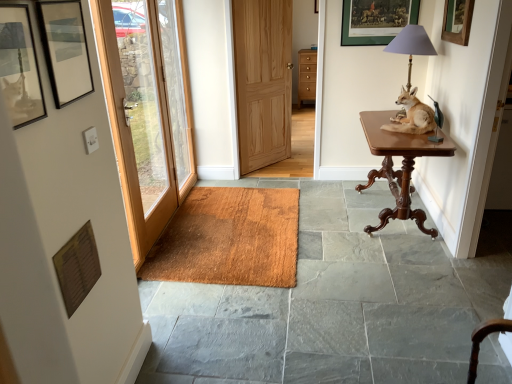
Question: From a real-world perspective, is clear glass door at left positioned above or below mahogany wood table at right?

Choices:
 (A) above
 (B) below

Answer: (A)

Question: Is point (179, 200) positioned closer to the camera than point (401, 180)?

Choices:
 (A) closer
 (B) farther

Answer: (B)

Question: Based on their relative distances, which object is nearer to the matte glass picture frame at upper left, which is the 2th picture frame in front-to-back order?

Choices:
 (A) natural wood door at center, placed as the first door when sorted from back to front
 (B) metallic gray lampshade at upper right
 (C) clear glass door at left
 (D) matte black picture frame at upper left, which is the 4th picture frame from top to bottom
 (E) wooden picture frame at upper center, which is counted as the first picture frame, starting from the back

Answer: (D)

Question: Estimate the real-world distances between objects in this image. Which object is closer to the wooden picture frame at upper right, which is counted as the first picture frame, starting from the right?

Choices:
 (A) brown fur dog at right
 (B) wooden door at left, positioned as the first door in left-to-right order
 (C) matte black picture frame at upper left, acting as the first picture frame starting from the bottom
 (D) clear glass door at left
 (E) mahogany wood table at right

Answer: (A)